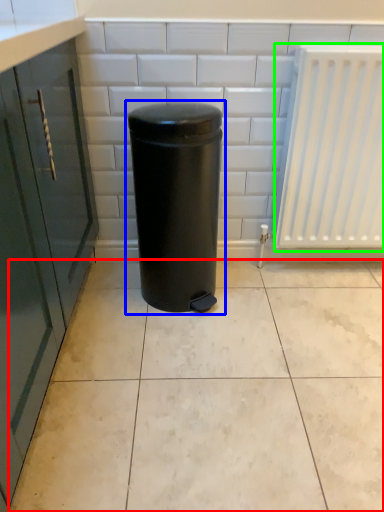
Question: Considering the real-world distances, which object is closest to ceramic tile (highlighted by a red box)? waste container (highlighted by a blue box) or radiator (highlighted by a green box).

Choices:
 (A) waste container
 (B) radiator

Answer: (A)